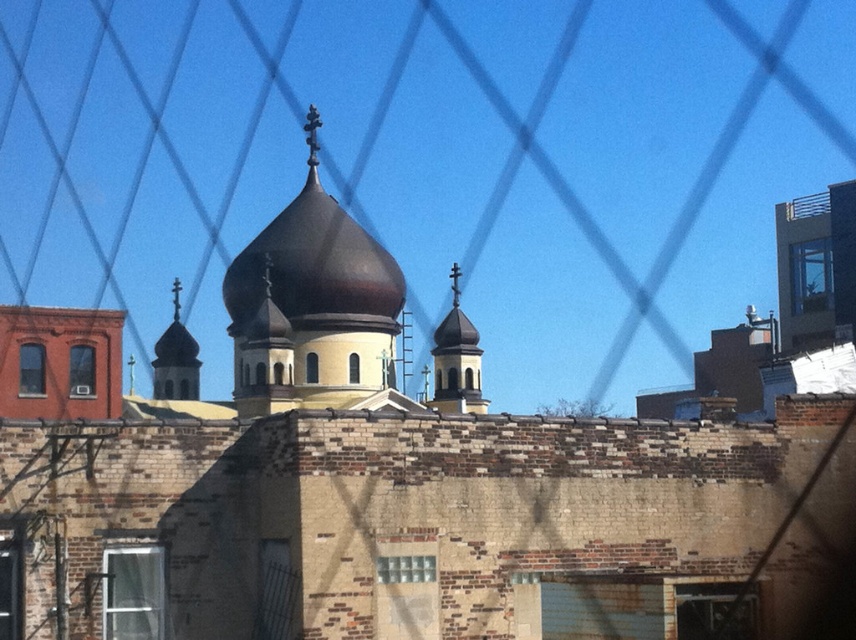
Question: Does shiny brown dome at center come in front of matte gold dome at left?

Choices:
 (A) no
 (B) yes

Answer: (B)

Question: Which point is closer to the camera?

Choices:
 (A) (319, 211)
 (B) (189, 372)

Answer: (A)

Question: Where is shiny brown dome at center located in relation to matte gold dome at left in the image?

Choices:
 (A) left
 (B) right

Answer: (B)

Question: Can you confirm if shiny brown dome at center is positioned below matte gold dome at left?

Choices:
 (A) no
 (B) yes

Answer: (A)

Question: Which object appears farthest from the camera in this image?

Choices:
 (A) shiny brown dome at center
 (B) matte gold dome at left

Answer: (B)